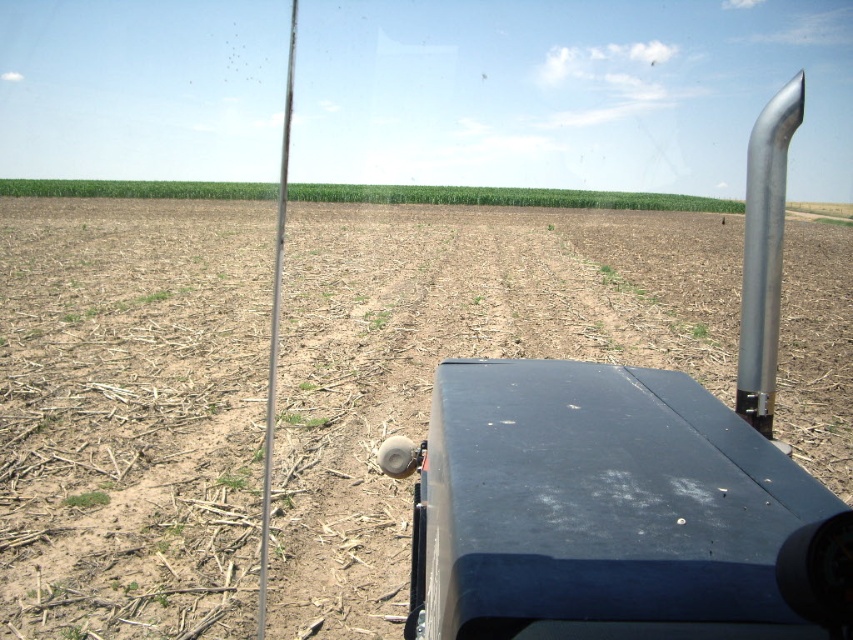
Question: Among these objects, which one is nearest to the camera?

Choices:
 (A) brown dirt field at center
 (B) metallic exhaust pipe at center right

Answer: (B)

Question: Is brown dirt field at center smaller than metallic exhaust pipe at center right?

Choices:
 (A) yes
 (B) no

Answer: (B)

Question: Which point is farther to the camera?

Choices:
 (A) (567, 449)
 (B) (379, 522)

Answer: (B)

Question: Is brown dirt field at center positioned in front of metallic exhaust pipe at center right?

Choices:
 (A) no
 (B) yes

Answer: (A)

Question: From the image, what is the correct spatial relationship of brown dirt field at center in relation to metallic exhaust pipe at center right?

Choices:
 (A) left
 (B) right

Answer: (A)